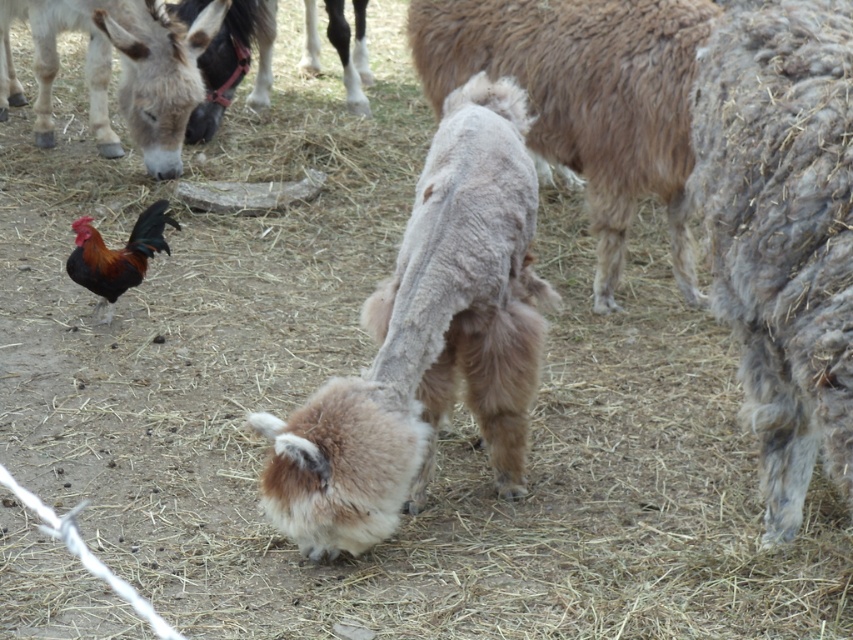
You are standing in the farmyard and want to take a photo of both the point at coordinates point (473, 406) and point (744, 29). Which point will appear closer to the camera in your photo?

Point (473, 406) is further to the camera than point (744, 29), so the point at (473, 406) will appear closer to the camera in the photo.

You are a farmer who needs to transport the gray woolen sheep at center and the fluffy brown sheep at center in a trailer that can only carry animals with a width of 1.2 meters or less. Based on the scene, can both sheep fit in the trailer?

The gray woolen sheep at center has a smaller width than the fluffy brown sheep at center. Since the fluffy brown sheep at center is wider than the gray woolen sheep at center, and the trailer can only carry animals with a width of 1.2 meters or less, we need to know the exact width of the fluffy brown sheep at center to determine if both can fit. However, the information provided does not specify the exact width measurements of either sheep, only their relative sizes. Therefore, it is impossible to confirm